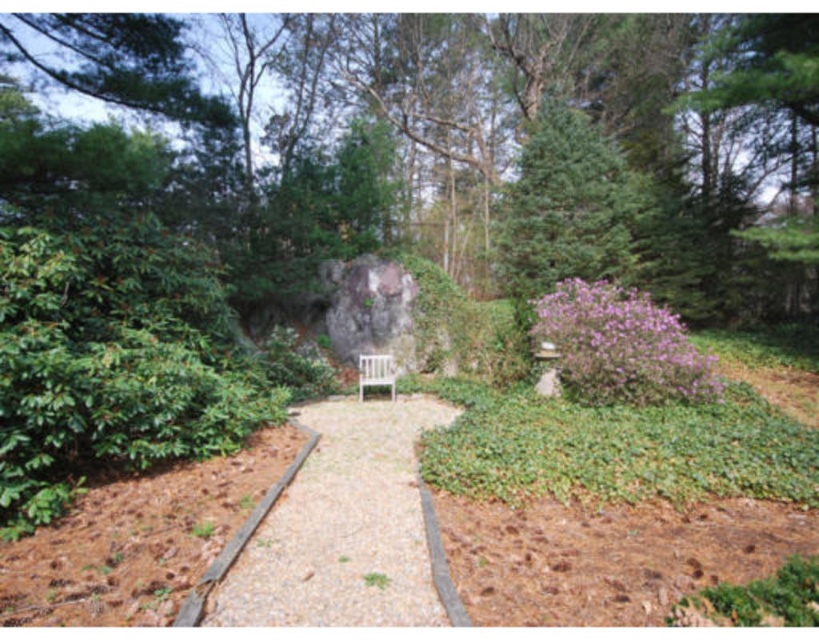
Question: Considering the real-world distances, which object is closest to the purple matte bush at center-right?

Choices:
 (A) green leafy tree at center
 (B) white wooden bench at center
 (C) gravel path at center

Answer: (B)

Question: Which point is closer to the camera?

Choices:
 (A) (605, 368)
 (B) (551, 237)
 (C) (441, 564)
 (D) (392, 376)

Answer: (C)

Question: Can you confirm if green leafy tree at center is thinner than purple matte bush at center-right?

Choices:
 (A) yes
 (B) no

Answer: (B)

Question: Is green leafy tree at center to the right of white wooden bench at center from the viewer's perspective?

Choices:
 (A) no
 (B) yes

Answer: (B)

Question: Is green leafy tree at center above gravel path at center?

Choices:
 (A) yes
 (B) no

Answer: (A)

Question: Which of these objects is positioned closest to the green leafy tree at center?

Choices:
 (A) gravel path at center
 (B) white wooden bench at center

Answer: (B)